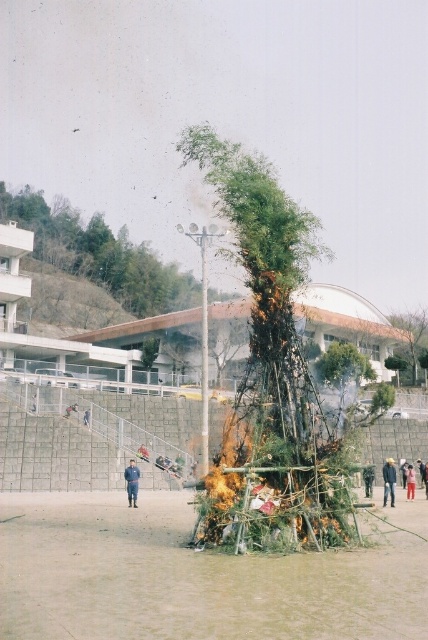
You are a firefighter assessing the scene. You see the bamboo at center and the red cotton jacket at center. Which object is positioned higher in the image?

The bamboo at center is located above the red cotton jacket at center, so the bamboo at center is positioned higher.